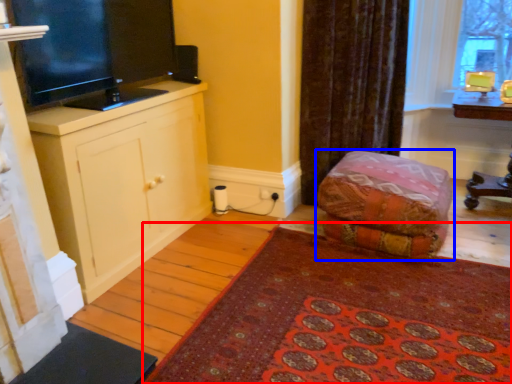
Question: Which object is closer to the camera taking this photo, mat (highlighted by a red box) or furniture (highlighted by a blue box)?

Choices:
 (A) mat
 (B) furniture

Answer: (A)